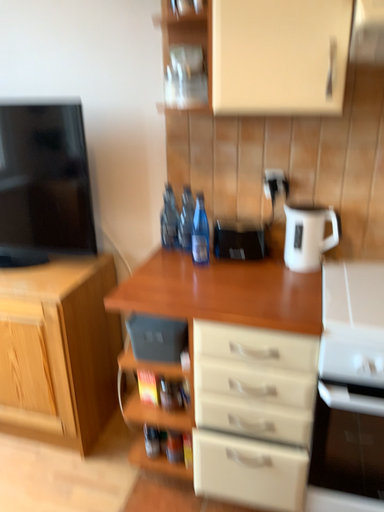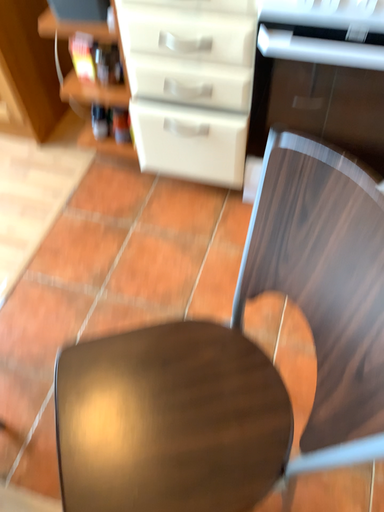
Question: Which way did the camera rotate in the video?

Choices:
 (A) rotated upward
 (B) rotated downward

Answer: (B)